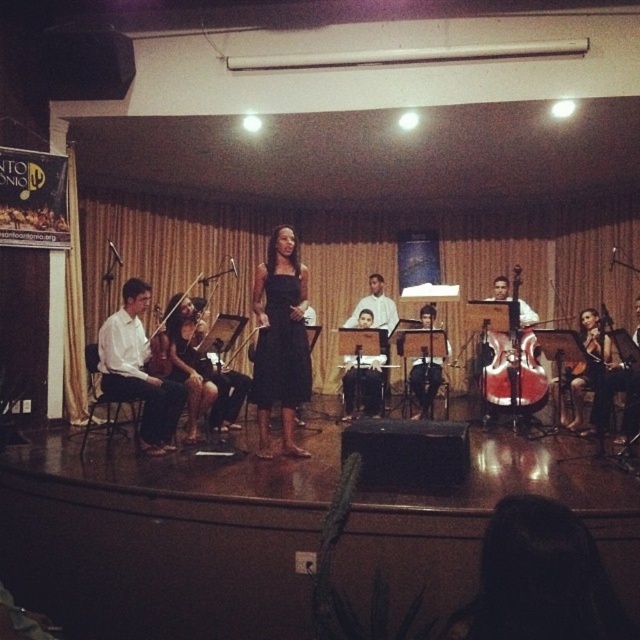
Question: Among these points, which one is nearest to the camera?

Choices:
 (A) (285, 365)
 (B) (128, 378)
 (C) (484, 365)

Answer: (B)

Question: Which point is closer to the camera?

Choices:
 (A) black satin dress at center
 (B) red glossy cello at center right

Answer: (A)

Question: Does black satin dress at center have a lesser width compared to shiny brown violin at right?

Choices:
 (A) yes
 (B) no

Answer: (A)

Question: Can you confirm if black satin dress at center is positioned to the left of white smooth shirt at left?

Choices:
 (A) no
 (B) yes

Answer: (A)

Question: Which is nearer to the black satin dress at center?

Choices:
 (A) shiny brown violin at right
 (B) white smooth shirt at left
 (C) red glossy cello at center right

Answer: (B)

Question: Observing the image, what is the correct spatial positioning of black satin dress at center in reference to red glossy cello at center right?

Choices:
 (A) left
 (B) right

Answer: (A)